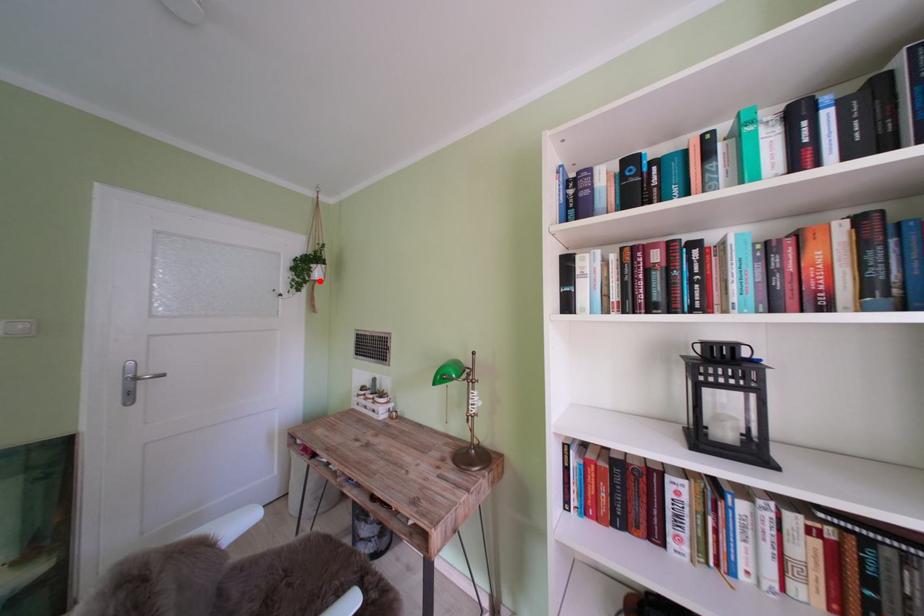
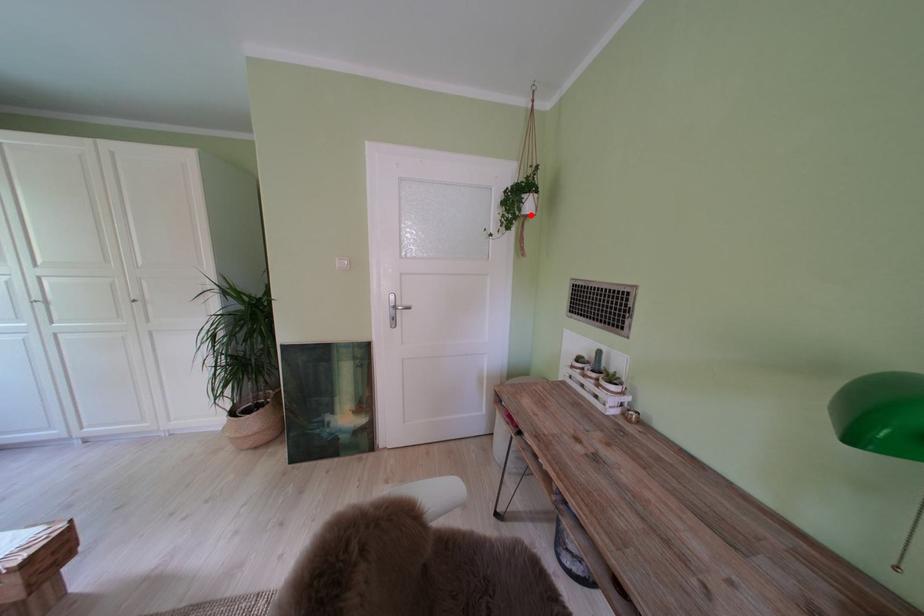
I am providing you with two images of the same scene from different viewpoints. A red point is marked on the first image and another point is marked on the second image. Do the highlighted points in image1 and image2 indicate the same real-world spot?

Yes